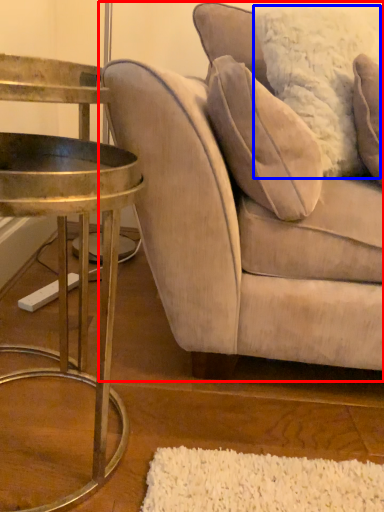
Question: Which of the following is the closest to the observer, studio couch (highlighted by a red box) or pillow (highlighted by a blue box)?

Choices:
 (A) studio couch
 (B) pillow

Answer: (A)